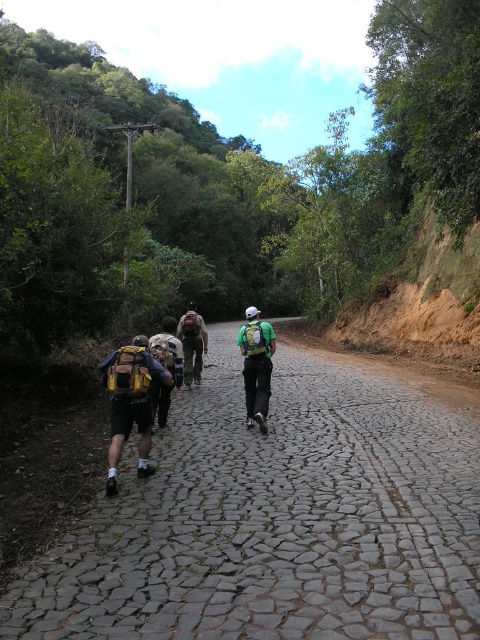
You are a hiker planning to walk along the gray cobblestone path at center. You notice a matte yellow backpack at center nearby. Which object is closer to the ground?

The gray cobblestone path at center is closer to the ground because it is positioned below the matte yellow backpack at center.

You are a hiker who wants to know the distance between the matte yellow backpack at center and the camouflage fabric backpack at center. Can you tell me how far apart they are?

The matte yellow backpack at center is 9.35 meters from camouflage fabric backpack at center.

You are standing at the point marked as point (282, 420) and want to walk towards the group of hikers. The path is 30 feet wide. Can you safely walk straight to them without crossing the path?

The distance between point (282, 420) and the viewer is 36.67 feet. Since the path is 30 feet wide, you can safely walk straight to the group of hikers as the distance is within the path width.